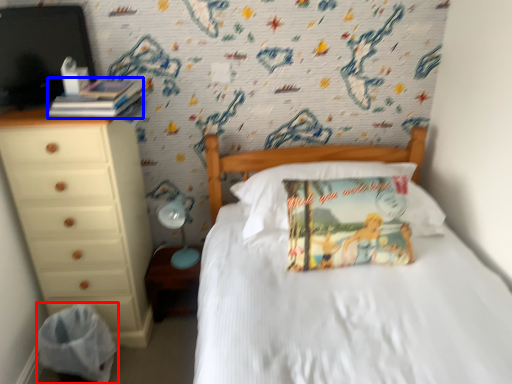
Question: Which object is further to the camera taking this photo, material (highlighted by a red box) or book (highlighted by a blue box)?

Choices:
 (A) material
 (B) book

Answer: (A)